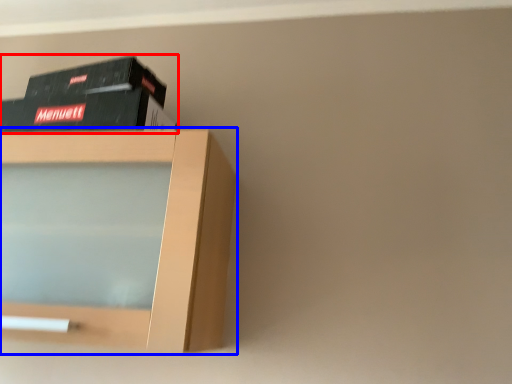
Question: Which of the following is the closest to the observer, book (highlighted by a red box) or shelf (highlighted by a blue box)?

Choices:
 (A) book
 (B) shelf

Answer: (B)